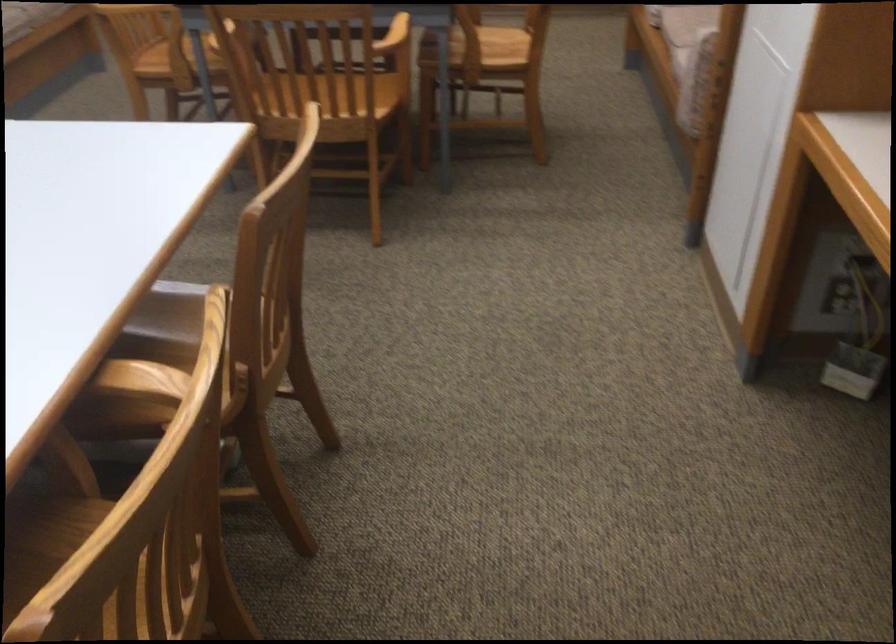
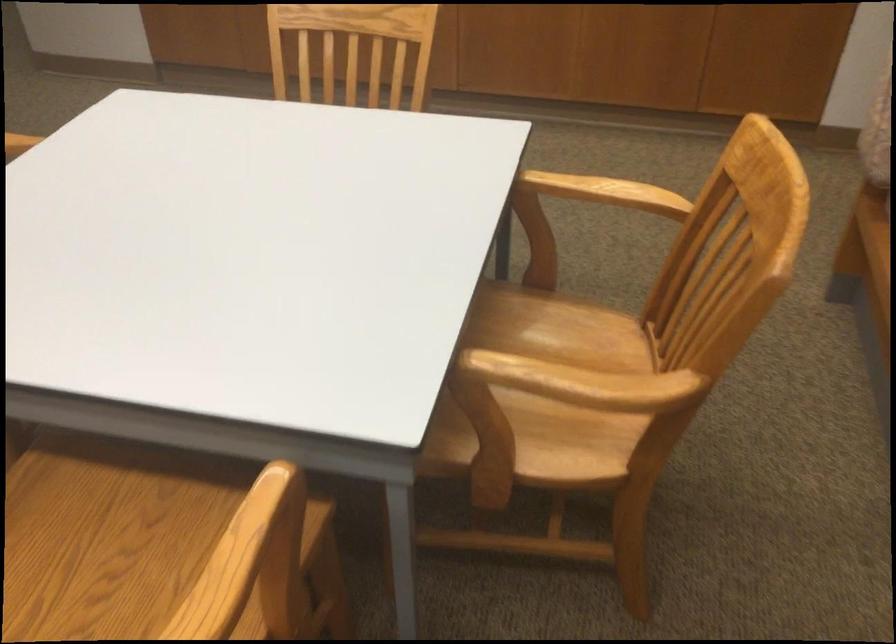
Question: In a continuous first-person perspective shot, in which direction is the camera moving?

Choices:
 (A) Left
 (B) Right
 (C) Forward
 (D) Backward

Answer: (C)